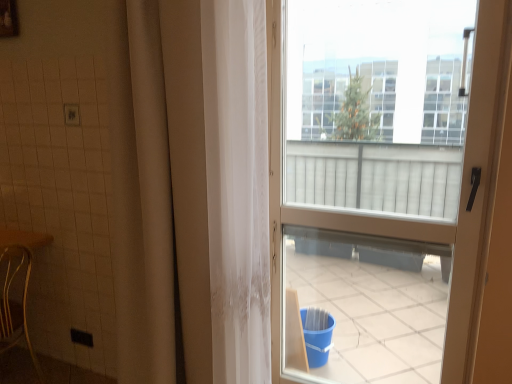
Question: From the image's perspective, is wooden chair at lower left below matte plastic door at upper right?

Choices:
 (A) no
 (B) yes

Answer: (B)

Question: Considering the relative positions of wooden chair at lower left and matte plastic door at upper right in the image provided, is wooden chair at lower left in front of matte plastic door at upper right?

Choices:
 (A) yes
 (B) no

Answer: (B)

Question: Considering the relative sizes of wooden chair at lower left and matte plastic door at upper right in the image provided, is wooden chair at lower left smaller than matte plastic door at upper right?

Choices:
 (A) no
 (B) yes

Answer: (B)

Question: Considering the relative sizes of wooden chair at lower left and matte plastic door at upper right in the image provided, is wooden chair at lower left wider than matte plastic door at upper right?

Choices:
 (A) yes
 (B) no

Answer: (A)

Question: From a real-world perspective, is wooden chair at lower left physically below matte plastic door at upper right?

Choices:
 (A) yes
 (B) no

Answer: (A)

Question: Is wooden chair at lower left oriented towards matte plastic door at upper right?

Choices:
 (A) yes
 (B) no

Answer: (B)

Question: Considering the relative sizes of matte plastic door at upper right and wooden chair at lower left in the image provided, is matte plastic door at upper right thinner than wooden chair at lower left?

Choices:
 (A) yes
 (B) no

Answer: (A)

Question: Is matte plastic door at upper right outside wooden chair at lower left?

Choices:
 (A) no
 (B) yes

Answer: (B)

Question: From a real-world perspective, is matte plastic door at upper right beneath wooden chair at lower left?

Choices:
 (A) yes
 (B) no

Answer: (B)

Question: Can you confirm if matte plastic door at upper right is taller than wooden chair at lower left?

Choices:
 (A) yes
 (B) no

Answer: (A)

Question: Is matte plastic door at upper right smaller than wooden chair at lower left?

Choices:
 (A) no
 (B) yes

Answer: (A)

Question: Is matte plastic door at upper right wider than wooden chair at lower left?

Choices:
 (A) no
 (B) yes

Answer: (A)

Question: Which is correct: matte plastic door at upper right is inside wooden chair at lower left, or outside of it?

Choices:
 (A) outside
 (B) inside

Answer: (A)